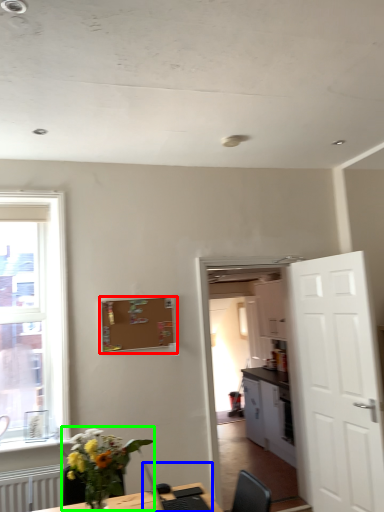
Question: Which is farther away from bulletin board (highlighted by a red box)? computer (highlighted by a blue box) or houseplant (highlighted by a green box)?

Choices:
 (A) computer
 (B) houseplant

Answer: (B)